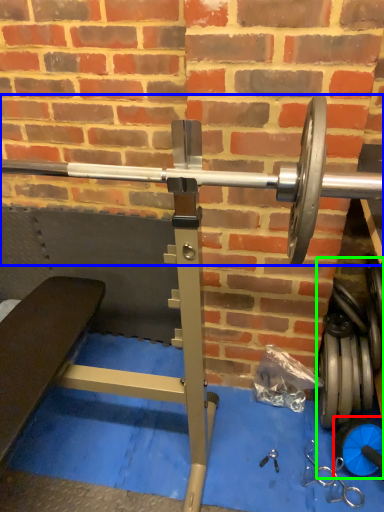
Question: Estimate the real-world distances between objects in this image. Which object is farther from dumbbell (highlighted by a red box), barbell (highlighted by a blue box) or dumbbell (highlighted by a green box)?

Choices:
 (A) barbell
 (B) dumbbell

Answer: (A)